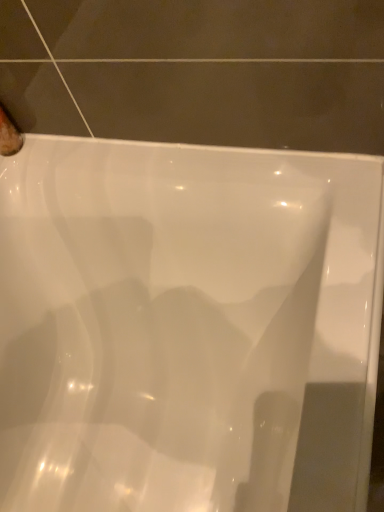
The width and height of the screenshot is (384, 512). What do you see at coordinates (187, 326) in the screenshot? I see `white glossy bathtub at center` at bounding box center [187, 326].

I want to click on white glossy bathtub at center, so click(x=187, y=326).

Locate an element on the screen. white glossy bathtub at center is located at coordinates (187, 326).